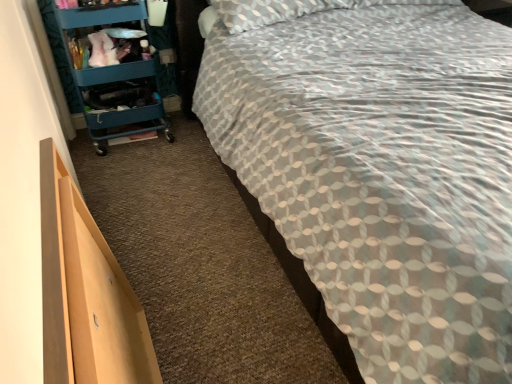
At what (x,y) coordinates should I click in order to perform the action: click on vacant area in front of teal plastic cart at left. Please return your answer as a coordinate pair (x, y). Looking at the image, I should click on (123, 170).